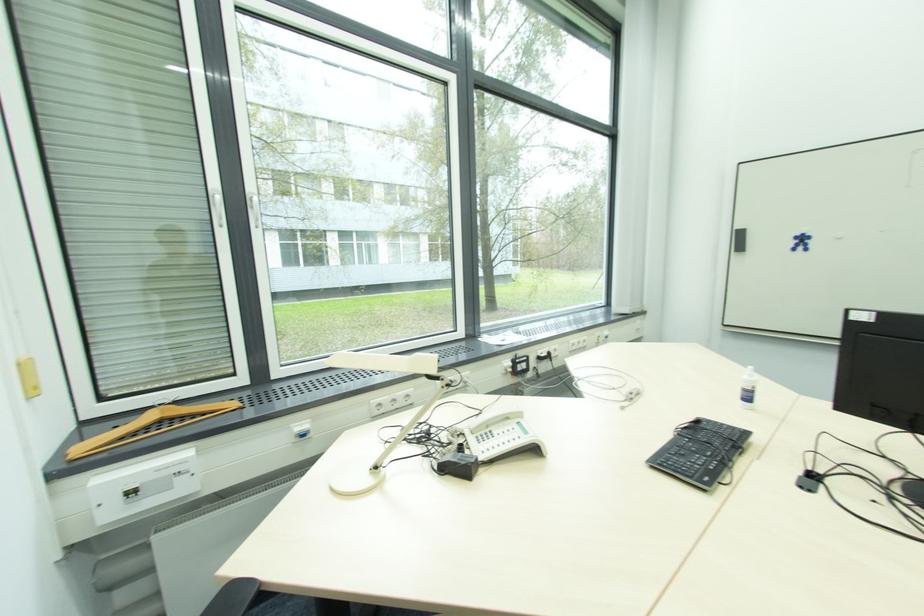
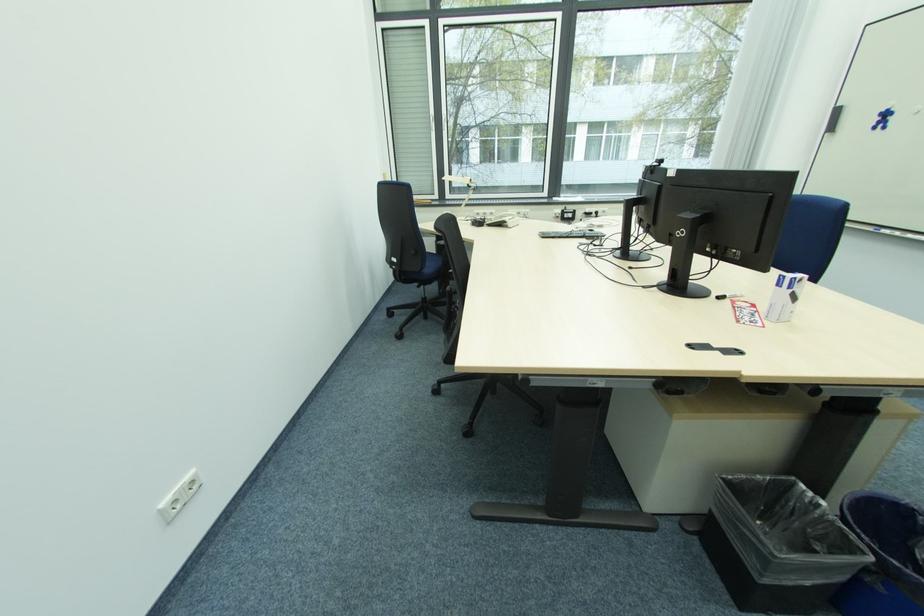
Find the pixel in the second image that matches [410,398] in the first image.

(494, 216)